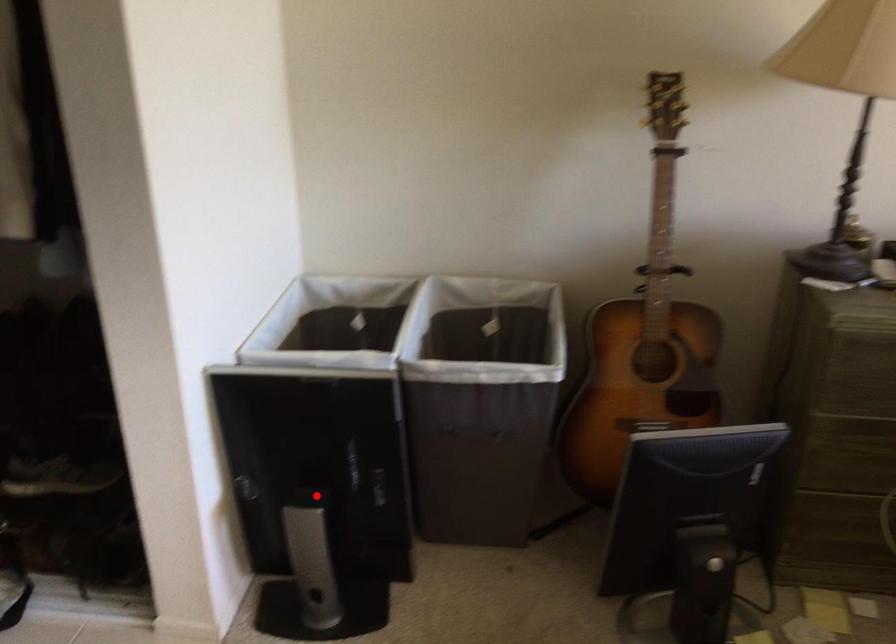
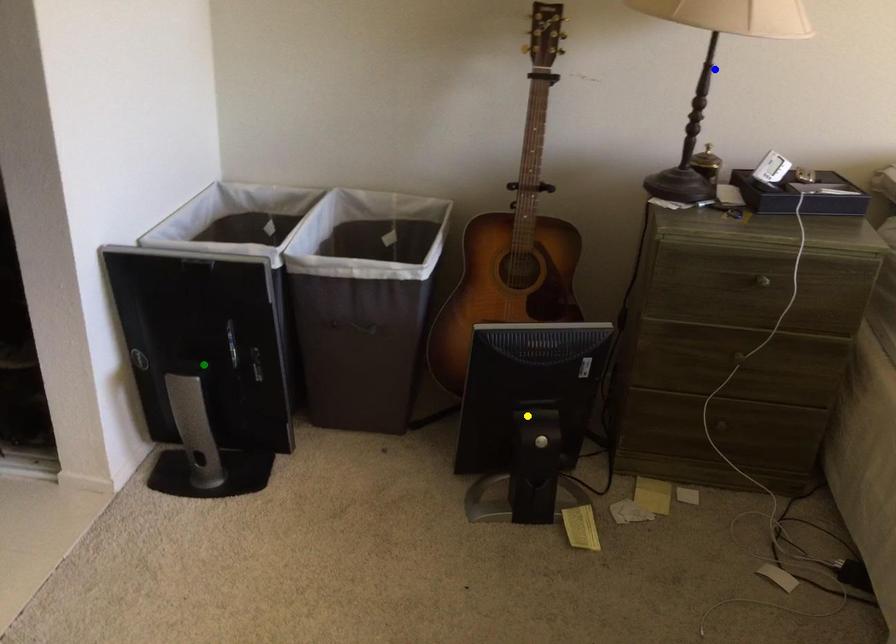
Question: I am providing you with two images of the same scene from different viewpoints. A red point is marked on the first image. You are given multiple points on the second image. Which point in image 2 represents the same 3d spot as the red point in image 1?

Choices:
 (A) green point
 (B) blue point
 (C) yellow point

Answer: (A)